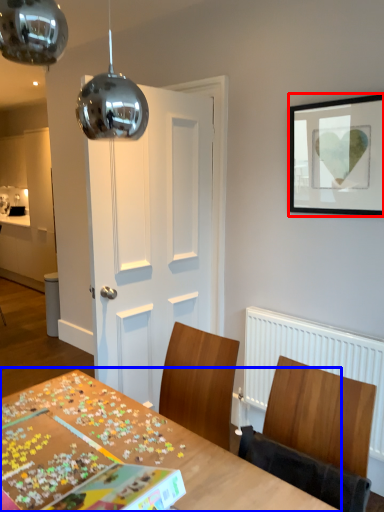
Question: Among these objects, which one is nearest to the camera, picture frame (highlighted by a red box) or table (highlighted by a blue box)?

Choices:
 (A) picture frame
 (B) table

Answer: (B)